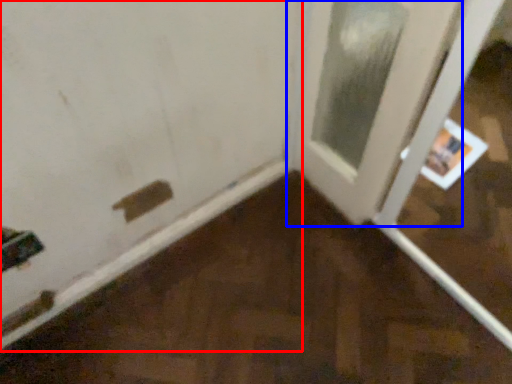
Question: Among these objects, which one is farthest to the camera, door (highlighted by a red box) or door (highlighted by a blue box)?

Choices:
 (A) door
 (B) door

Answer: (B)